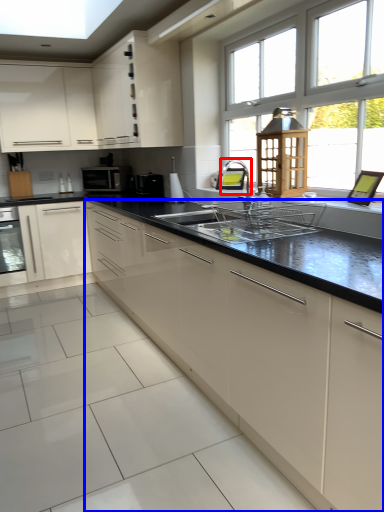
Question: Which object appears closest to the camera in this image, faucet (highlighted by a red box) or cabinetry (highlighted by a blue box)?

Choices:
 (A) faucet
 (B) cabinetry

Answer: (B)